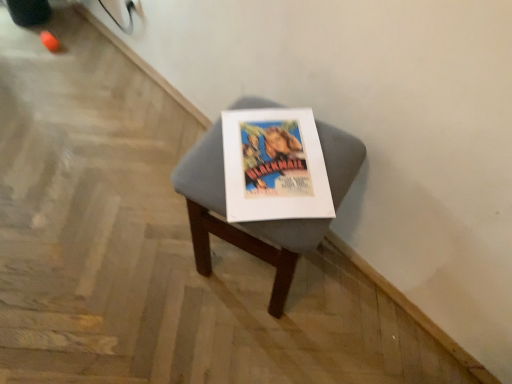
The image size is (512, 384). What do you see at coordinates (240, 223) in the screenshot? I see `gray fabric stool at center` at bounding box center [240, 223].

The image size is (512, 384). In order to click on gray fabric stool at center in this screenshot , I will do `click(240, 223)`.

You are a GUI agent. You are given a task and a screenshot of the screen. Output one action in this format:
    pyautogui.click(x=<x>, y=<y>)
    Task: Click on the matte paper poster at center
    The height and width of the screenshot is (384, 512).
    Given the screenshot: What is the action you would take?
    pyautogui.click(x=274, y=166)

What is the approximate height of matte paper poster at center?

It is 1.60 inches.

Describe the element at coordinates (274, 166) in the screenshot. I see `matte paper poster at center` at that location.

The image size is (512, 384). I want to click on gray fabric stool at center, so click(x=240, y=223).

Does gray fabric stool at center appear on the right side of matte paper poster at center?

No.

Is the position of gray fabric stool at center less distant than that of matte paper poster at center?

Yes, the depth of gray fabric stool at center is less than that of matte paper poster at center.

Which is closer to the camera, (211, 184) or (224, 130)?

The point (211, 184) is more forward.

From the image's perspective, is gray fabric stool at center under matte paper poster at center?

Indeed, from the image's perspective, gray fabric stool at center is shown beneath matte paper poster at center.

From a real-world perspective, which object rests below the other?

gray fabric stool at center is physically lower.

Which object is thinner, gray fabric stool at center or matte paper poster at center?

Thinner between the two is matte paper poster at center.

Between gray fabric stool at center and matte paper poster at center, which one has more height?

Standing taller between the two is gray fabric stool at center.

Between gray fabric stool at center and matte paper poster at center, which one has smaller size?

matte paper poster at center.

Does gray fabric stool at center contain matte paper poster at center?

Indeed, matte paper poster at center is located within gray fabric stool at center.

Is gray fabric stool at center not near matte paper poster at center?

No, there isn't a large distance between gray fabric stool at center and matte paper poster at center.

Is gray fabric stool at center looking in the opposite direction of matte paper poster at center?

No.

I want to click on magazine lying behind the gray fabric stool at center, so click(x=274, y=166).

Is matte paper poster at center to the right of gray fabric stool at center from the viewer's perspective?

Correct, you'll find matte paper poster at center to the right of gray fabric stool at center.

Does matte paper poster at center come behind gray fabric stool at center?

Yes, matte paper poster at center is behind gray fabric stool at center.

Is point (244, 160) behind point (271, 308)?

No, (244, 160) is in front of (271, 308).

From the image's perspective, is matte paper poster at center located beneath gray fabric stool at center?

No, from the image's perspective, matte paper poster at center is not beneath gray fabric stool at center.

Consider the image. From a real-world perspective, which is physically below, matte paper poster at center or gray fabric stool at center?

gray fabric stool at center.

Looking at this image, can you confirm if matte paper poster at center is wider than gray fabric stool at center?

No, matte paper poster at center is not wider than gray fabric stool at center.

Is matte paper poster at center taller than gray fabric stool at center?

No.

Which of these two, matte paper poster at center or gray fabric stool at center, is smaller?

matte paper poster at center is smaller.

Is matte paper poster at center spatially inside gray fabric stool at center, or outside of it?

matte paper poster at center is spatially positioned inside gray fabric stool at center.

Are matte paper poster at center and gray fabric stool at center making contact?

Yes, matte paper poster at center is in contact with gray fabric stool at center.

Is matte paper poster at center oriented towards gray fabric stool at center?

Yes, matte paper poster at center is aimed at gray fabric stool at center.

In the scene shown: How different are the orientations of matte paper poster at center and gray fabric stool at center in degrees?

34.1 degrees separate the facing orientations of matte paper poster at center and gray fabric stool at center.

The height and width of the screenshot is (384, 512). In order to click on furniture in front of the matte paper poster at center in this screenshot , I will do `click(240, 223)`.

Locate an element on the screen. magazine on the right of gray fabric stool at center is located at coordinates (274, 166).

Find the location of a particular element. magazine above the gray fabric stool at center (from the image's perspective) is located at coordinates (274, 166).